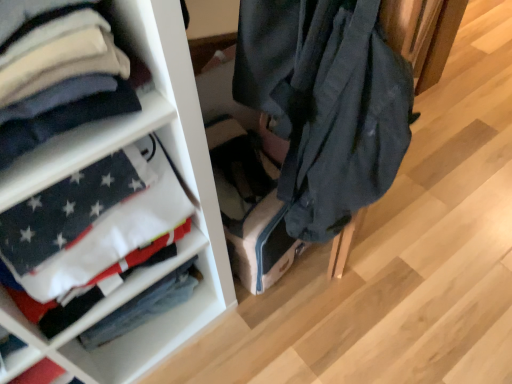
This screenshot has width=512, height=384. In order to click on vacant location below white fabric at left (from a real-world perspective) in this screenshot , I will do `click(163, 340)`.